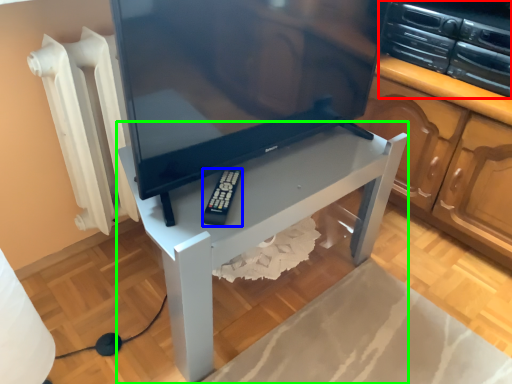
Question: Estimate the real-world distances between objects in this image. Which object is farther from appliance (highlighted by a red box), equipment (highlighted by a blue box) or furniture (highlighted by a green box)?

Choices:
 (A) equipment
 (B) furniture

Answer: (A)